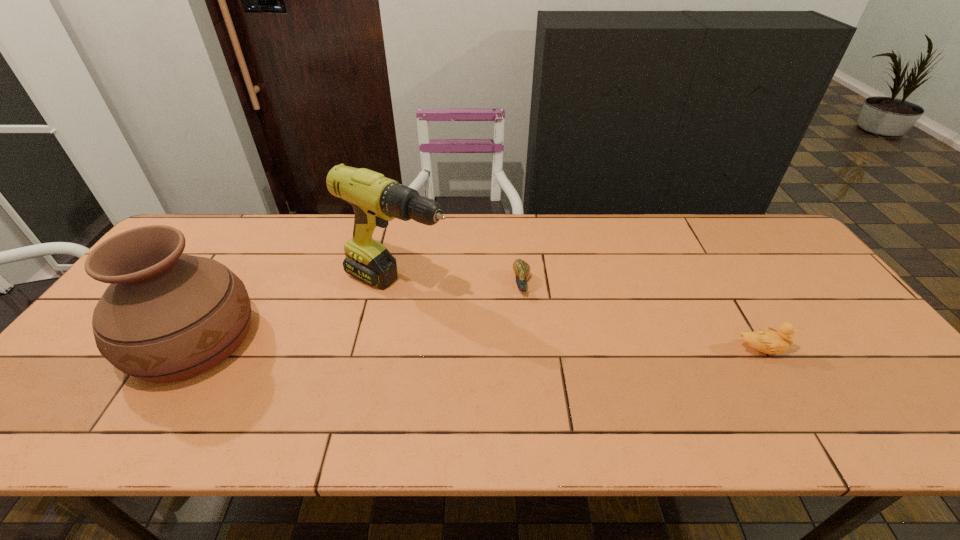
You are a GUI agent. You are given a task and a screenshot of the screen. Output one action in this format:
    pyautogui.click(x=<x>, y=<y>)
    Task: Click on the second tallest object
    This screenshot has height=540, width=960.
    Given the screenshot: What is the action you would take?
    click(165, 317)

Locate an element on the screen. The width and height of the screenshot is (960, 540). the leftmost object is located at coordinates (165, 317).

This screenshot has width=960, height=540. What are the coordinates of `the second shortest object` in the screenshot? It's located at (769, 341).

Locate an element on the screen. The width and height of the screenshot is (960, 540). duckling is located at coordinates (769, 341).

This screenshot has width=960, height=540. I want to click on escargot, so click(521, 268).

Find the location of `the shortest object`. the shortest object is located at coordinates (521, 268).

The height and width of the screenshot is (540, 960). In order to click on the tallest object in this screenshot , I will do `click(376, 200)`.

Image resolution: width=960 pixels, height=540 pixels. Find the location of `the third object from right to left`. the third object from right to left is located at coordinates (376, 200).

This screenshot has width=960, height=540. I want to click on vacant space located on the right of the leftmost object, so click(x=331, y=340).

Locate an element on the screen. vacant position located 0.210m on the face of the third tallest object is located at coordinates coord(870,350).